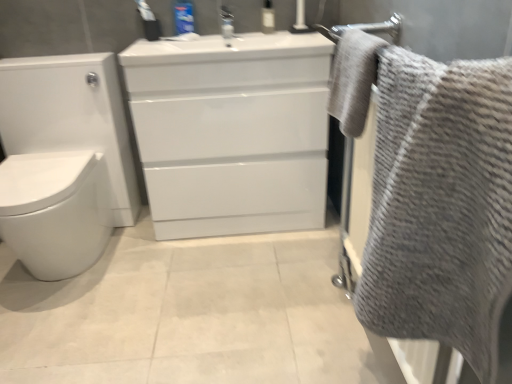
At what (x,y) coordinates should I click in order to perform the action: click on vacant area to the right of blue plastic toothpaste tube at upper center, which is counted as the 1th toiletry, starting from the left. Please return your answer as a coordinate pair (x, y). This screenshot has height=384, width=512. Looking at the image, I should click on click(216, 34).